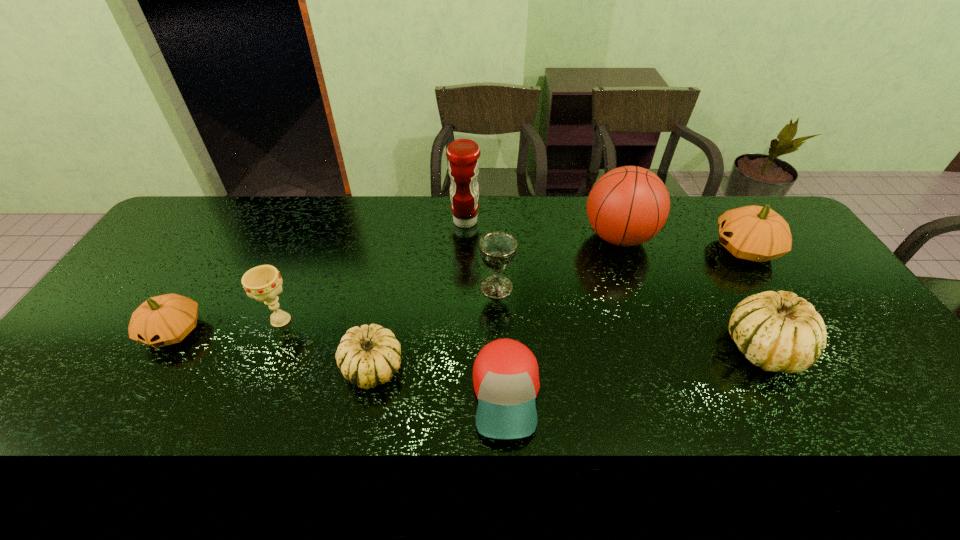
You are a GUI agent. You are given a task and a screenshot of the screen. Output one action in this format:
    pyautogui.click(x=<x>, y=<y>)
    Task: Click on the nearer orange gourd
    The image size is (960, 540).
    Given the screenshot: What is the action you would take?
    pyautogui.click(x=167, y=319)

Identify the location of the smaller white gourd. (368, 356).

This screenshot has width=960, height=540. Identify the location of the third object from left to right. (368, 356).

At what (x,y) coordinates should I click in order to perform the action: click on baseball cap. Please return your answer as a coordinate pair (x, y). Image resolution: width=960 pixels, height=540 pixels. Looking at the image, I should click on (505, 374).

At what (x,y) coordinates should I click in order to perform the action: click on the shortest object. Please return your answer as a coordinate pair (x, y). Image resolution: width=960 pixels, height=540 pixels. Looking at the image, I should click on (505, 374).

The width and height of the screenshot is (960, 540). What are the coordinates of `vacant area situated on the left of the condiment` in the screenshot? It's located at (373, 221).

Where is `vacant space positioned 0.280m on the front of the third object from right to left`? The width and height of the screenshot is (960, 540). vacant space positioned 0.280m on the front of the third object from right to left is located at coordinates (652, 333).

I want to click on free space located on the side of the farther orange gourd with the carved face, so click(x=612, y=249).

Locate an element on the screen. The height and width of the screenshot is (540, 960). vacant space positioned 0.200m on the side of the farther orange gourd with the carved face is located at coordinates (651, 249).

The height and width of the screenshot is (540, 960). What are the coordinates of `vacant position located 0.330m on the side of the farther orange gourd with the carved face` in the screenshot? It's located at (612, 249).